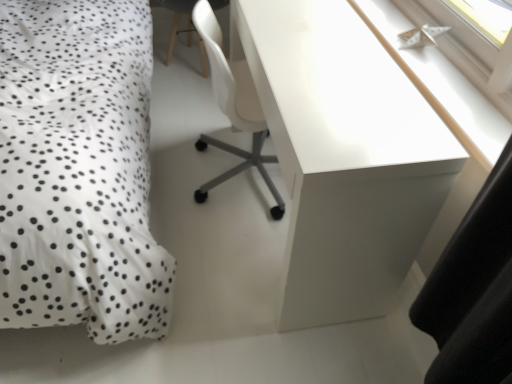
Question: Considering the relative sizes of white dotted fabric at left and white glossy desk at upper right in the image provided, is white dotted fabric at left taller than white glossy desk at upper right?

Choices:
 (A) yes
 (B) no

Answer: (A)

Question: Can you confirm if white dotted fabric at left is thinner than white glossy desk at upper right?

Choices:
 (A) no
 (B) yes

Answer: (A)

Question: Can we say white dotted fabric at left lies outside white glossy desk at upper right?

Choices:
 (A) yes
 (B) no

Answer: (A)

Question: Considering the relative sizes of white dotted fabric at left and white glossy desk at upper right in the image provided, is white dotted fabric at left wider than white glossy desk at upper right?

Choices:
 (A) yes
 (B) no

Answer: (A)

Question: Is white glossy desk at upper right inside white dotted fabric at left?

Choices:
 (A) no
 (B) yes

Answer: (A)

Question: From the image's perspective, is white glossy paper boat at upper right positioned above or below white dotted fabric at left?

Choices:
 (A) above
 (B) below

Answer: (B)

Question: In the image, is white glossy paper boat at upper right positioned in front of or behind white dotted fabric at left?

Choices:
 (A) front
 (B) behind

Answer: (B)

Question: Which is correct: white glossy paper boat at upper right is inside white dotted fabric at left, or outside of it?

Choices:
 (A) outside
 (B) inside

Answer: (A)

Question: Considering the positions of white glossy paper boat at upper right and white dotted fabric at left in the image, is white glossy paper boat at upper right wider or thinner than white dotted fabric at left?

Choices:
 (A) wide
 (B) thin

Answer: (B)

Question: Looking at the image, does white glossy desk at upper right seem bigger or smaller compared to white plastic chair at center?

Choices:
 (A) small
 (B) big

Answer: (B)

Question: Considering the positions of white glossy desk at upper right and white plastic chair at center in the image, is white glossy desk at upper right taller or shorter than white plastic chair at center?

Choices:
 (A) short
 (B) tall

Answer: (B)

Question: In the image, is white glossy desk at upper right positioned in front of or behind white plastic chair at center?

Choices:
 (A) behind
 (B) front

Answer: (B)

Question: Is point (257, 87) positioned closer to the camera than point (211, 6)?

Choices:
 (A) farther
 (B) closer

Answer: (B)

Question: From a real-world perspective, is white glossy desk at upper right above or below white dotted fabric at left?

Choices:
 (A) above
 (B) below

Answer: (B)

Question: Does point (377, 170) appear closer or farther from the camera than point (130, 200)?

Choices:
 (A) farther
 (B) closer

Answer: (B)